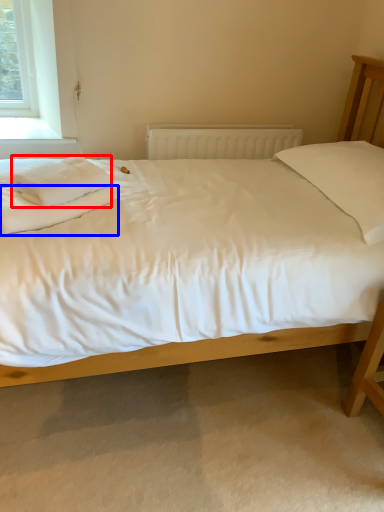
Question: Which point is further to the camera, material (highlighted by a red box) or sheet (highlighted by a blue box)?

Choices:
 (A) material
 (B) sheet

Answer: (A)